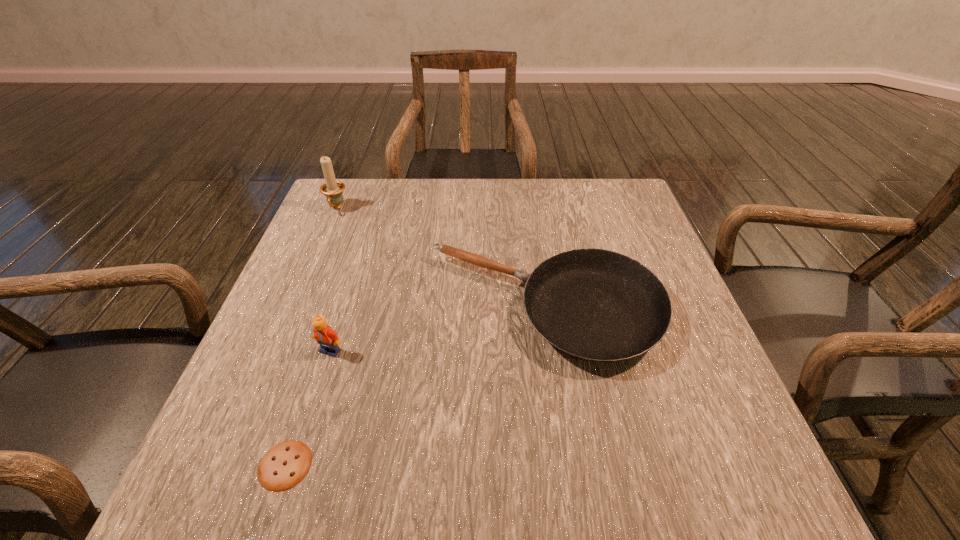
This screenshot has width=960, height=540. In the image, there is a desktop. Identify the location of vacant area at the near edge. (382, 485).

The width and height of the screenshot is (960, 540). In the image, there is a desktop. In order to click on free region at the left edge in this screenshot , I will do `click(342, 259)`.

At what (x,y) coordinates should I click in order to perform the action: click on blank area at the right edge. Please return your answer as a coordinate pair (x, y). This screenshot has height=540, width=960. Looking at the image, I should click on (595, 230).

This screenshot has height=540, width=960. In the image, there is a desktop. Identify the location of blank space at the far left corner. (355, 208).

This screenshot has height=540, width=960. In order to click on vacant space at the near left corner of the desktop in this screenshot , I will do `click(207, 498)`.

The width and height of the screenshot is (960, 540). Find the location of `free space at the far right corner`. free space at the far right corner is located at coordinates (584, 180).

Where is `free space at the near right corner of the desktop`? This screenshot has height=540, width=960. free space at the near right corner of the desktop is located at coordinates (777, 501).

This screenshot has height=540, width=960. I want to click on vacant area between the Lego and the cookie, so click(308, 408).

This screenshot has height=540, width=960. I want to click on vacant region between the tallest object and the rightmost object, so click(x=441, y=258).

Image resolution: width=960 pixels, height=540 pixels. I want to click on vacant region between the nearest object and the second tallest object, so click(308, 408).